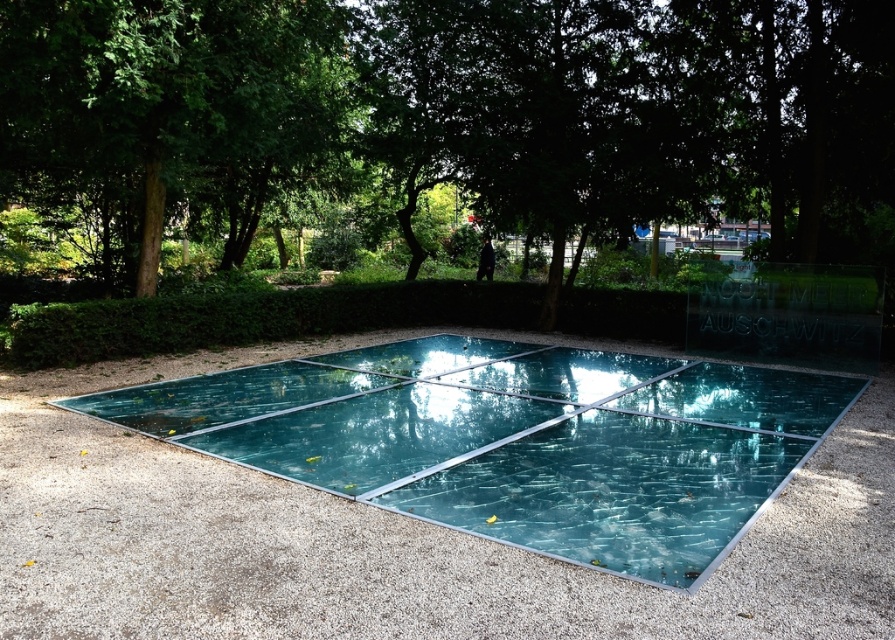
You are a landscape architect designing a new pathway. You need to place a bench exactly halfway between the transparent glass pool at center and the green leafy tree at upper left. How far will the bench be from each of these two objects?

The bench will be 9.54 feet away from both the transparent glass pool at center and the green leafy tree at upper left since the distance between them is 19.08 feet, so half of that distance is 9.54 feet.

You are a visitor at the park and want to take a photo of the transparent glass pool at center and the green leafy tree at upper left. Where should you position yourself to ensure both are visible in the frame?

Position yourself below the transparent glass pool at center so that the green leafy tree at upper left appears above it in the frame.